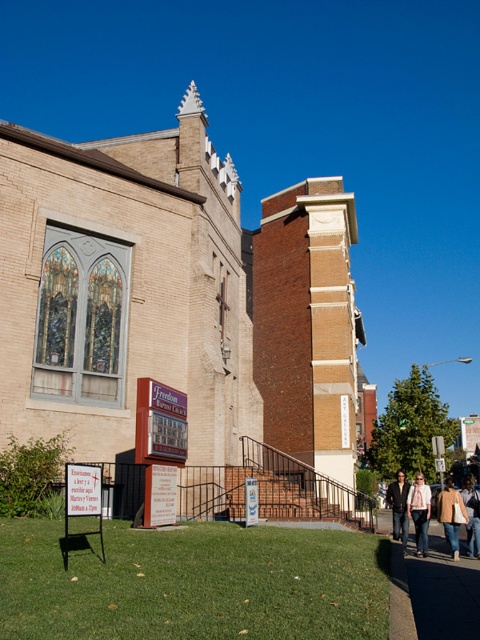
Question: Among these points, which one is farthest from the camera?

Choices:
 (A) (469, 545)
 (B) (400, 497)

Answer: (B)

Question: Does denim jacket at lower right appear on the right side of light brown leather jacket at lower right?

Choices:
 (A) no
 (B) yes

Answer: (A)

Question: Can you confirm if brick church at center is positioned below denim jacket at lower right?

Choices:
 (A) no
 (B) yes

Answer: (A)

Question: Which object is farther from the camera taking this photo?

Choices:
 (A) brick church at center
 (B) light brown leather jacket at lower right

Answer: (B)

Question: Does brick church at center have a larger size compared to tan leather jacket at lower right?

Choices:
 (A) yes
 (B) no

Answer: (A)

Question: Which object is positioned closest to the dark brown leather jacket at lower right?

Choices:
 (A) light brown leather jacket at lower right
 (B) denim jacket at lower right

Answer: (B)